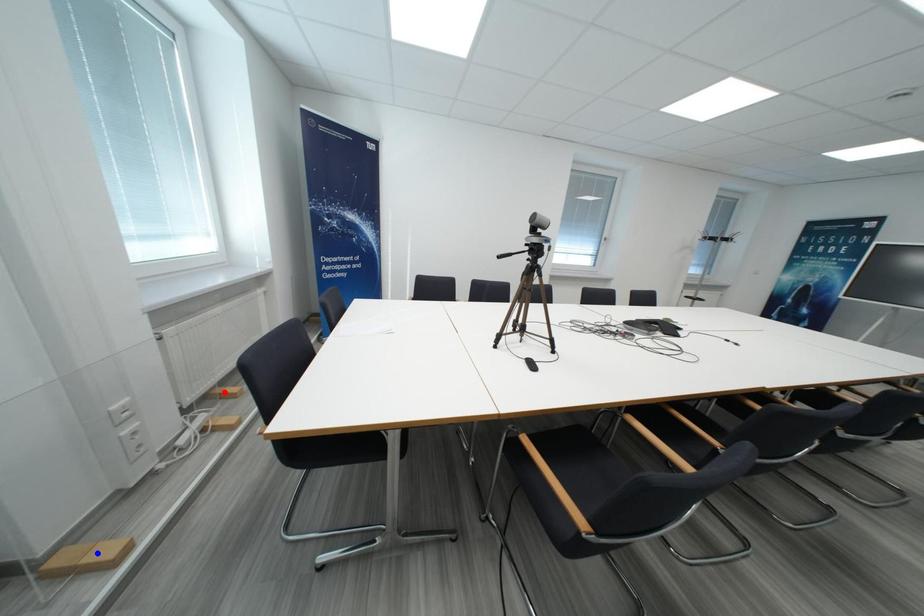
Question: In the image, two points are highlighted. Which point is nearer to the camera? Reply with the corresponding letter.

Choices:
 (A) blue point
 (B) red point

Answer: (A)